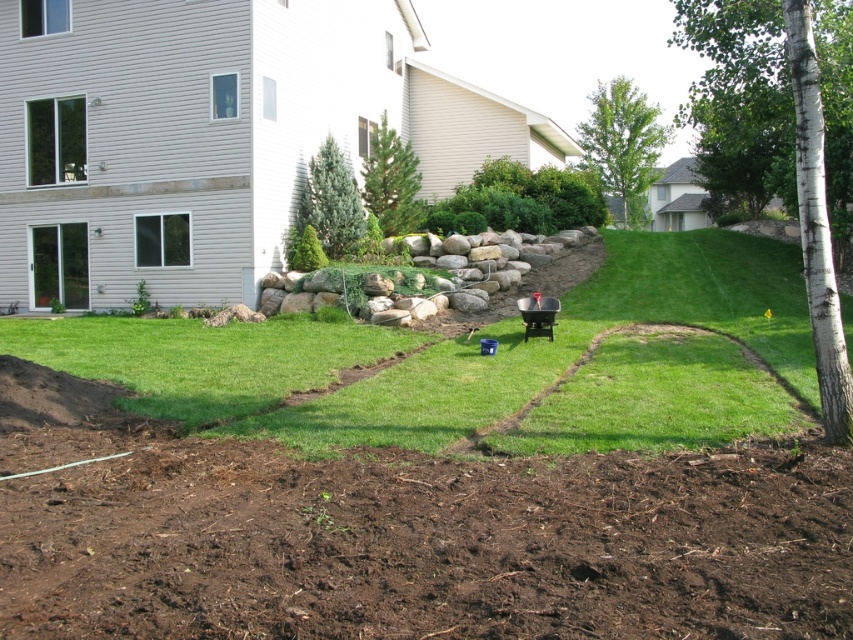
Question: Does green leafy bush at center have a larger size compared to green leafy tree at upper center?

Choices:
 (A) yes
 (B) no

Answer: (B)

Question: Which of the following is the closest to the observer?

Choices:
 (A) green textured pine tree at center
 (B) green fir tree at center
 (C) green leafy tree at upper center

Answer: (B)

Question: From the image, what is the correct spatial relationship of green leafy bush at center in relation to green leafy tree at upper center?

Choices:
 (A) left
 (B) right

Answer: (A)

Question: Is white smooth tree at right smaller than green leafy bush at center?

Choices:
 (A) yes
 (B) no

Answer: (B)

Question: Which of these objects is positioned farthest from the white smooth tree at right?

Choices:
 (A) green leafy tree at upper center
 (B) green textured pine tree at center
 (C) green fir tree at center

Answer: (A)

Question: Which object appears closest to the camera in this image?

Choices:
 (A) green fir tree at center
 (B) white smooth tree at right

Answer: (B)